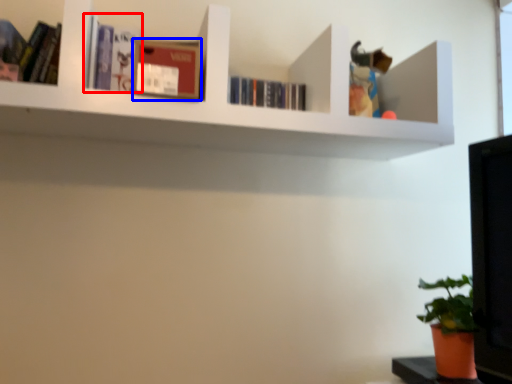
Question: Which of the following is the farthest to the observer, book (highlighted by a red box) or paperback book (highlighted by a blue box)?

Choices:
 (A) book
 (B) paperback book

Answer: (A)